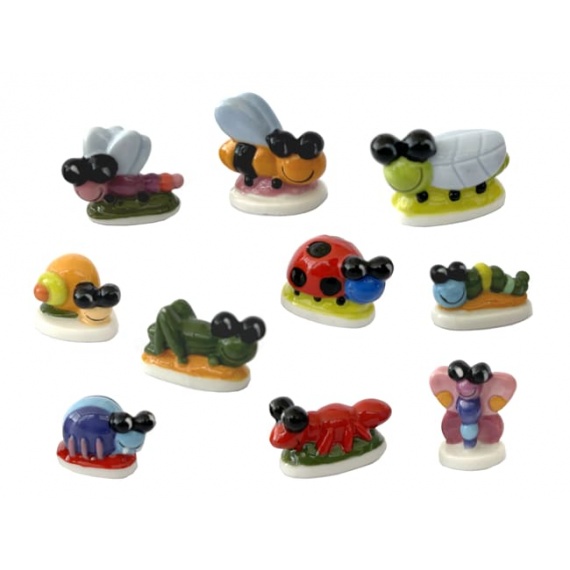
Image resolution: width=570 pixels, height=570 pixels. Identify the location of insect figurines. (121, 183), (294, 164), (451, 164), (470, 291), (336, 266), (219, 342), (69, 285), (107, 424), (331, 439), (469, 412).